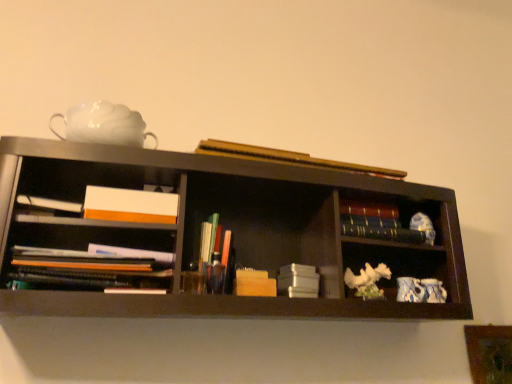
Question: Is matte black books at left, arranged as the 6th book when viewed from the right, located within matte plastic pens at center, the fifth book positioned from the right?

Choices:
 (A) no
 (B) yes

Answer: (A)

Question: Does matte plastic pens at center, the fifth book positioned from the right, have a greater width compared to matte black books at left, the 1th book positioned from the left?

Choices:
 (A) yes
 (B) no

Answer: (B)

Question: Is matte plastic pens at center, arranged as the 2th book when viewed from the left, not near matte black books at left, arranged as the 6th book when viewed from the right?

Choices:
 (A) no
 (B) yes

Answer: (A)

Question: From the image's perspective, would you say matte plastic pens at center, the fifth book positioned from the right, is positioned over matte black books at left, arranged as the 6th book when viewed from the right?

Choices:
 (A) yes
 (B) no

Answer: (A)

Question: Is matte plastic pens at center, arranged as the 2th book when viewed from the left, to the left of matte black books at left, the 1th book positioned from the left, from the viewer's perspective?

Choices:
 (A) no
 (B) yes

Answer: (A)

Question: Considering the relative sizes of matte plastic pens at center, the fifth book positioned from the right, and matte black books at left, the 1th book positioned from the left, in the image provided, is matte plastic pens at center, the fifth book positioned from the right, taller than matte black books at left, the 1th book positioned from the left,?

Choices:
 (A) yes
 (B) no

Answer: (A)

Question: From a real-world perspective, is wooden block at center, marked as the fourth book in a right-to-left arrangement, below matte black books at left, arranged as the 6th book when viewed from the right?

Choices:
 (A) no
 (B) yes

Answer: (B)

Question: Is wooden block at center, marked as the fourth book in a right-to-left arrangement, at the right side of matte black books at left, the 1th book positioned from the left?

Choices:
 (A) yes
 (B) no

Answer: (A)

Question: Does wooden block at center, marked as the fourth book in a right-to-left arrangement, turn towards matte black books at left, arranged as the 6th book when viewed from the right?

Choices:
 (A) no
 (B) yes

Answer: (A)

Question: Is wooden block at center, marked as the fourth book in a right-to-left arrangement, in front of matte black books at left, arranged as the 6th book when viewed from the right?

Choices:
 (A) yes
 (B) no

Answer: (B)

Question: Is wooden block at center, marked as the fourth book in a right-to-left arrangement, further to camera compared to matte black books at left, arranged as the 6th book when viewed from the right?

Choices:
 (A) no
 (B) yes

Answer: (B)

Question: From a real-world perspective, is wooden block at center, the third book positioned from the left, physically above matte black books at left, the 1th book positioned from the left?

Choices:
 (A) no
 (B) yes

Answer: (A)

Question: Can you confirm if matte black books at left, arranged as the 6th book when viewed from the right, is bigger than wooden block at center, the third book positioned from the left?

Choices:
 (A) yes
 (B) no

Answer: (A)